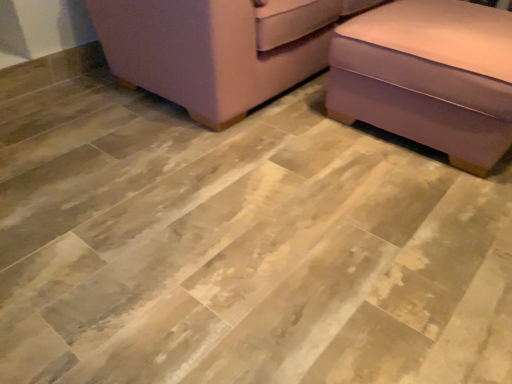
Measure the distance between point (446, 89) and camera.

Point (446, 89) and camera are 5.08 feet apart from each other.

Describe the element at coordinates (428, 77) in the screenshot. I see `purple fabric ottoman at lower right, the first furniture positioned from the right` at that location.

Find the location of a particular element. This screenshot has height=384, width=512. purple fabric ottoman at lower right, the first furniture positioned from the right is located at coordinates (428, 77).

Locate an element on the screen. The height and width of the screenshot is (384, 512). pink fabric couch at upper right, positioned as the first furniture in left-to-right order is located at coordinates (218, 49).

Measure the distance between pink fabric couch at upper right, positioned as the first furniture in left-to-right order, and camera.

The distance of pink fabric couch at upper right, positioned as the first furniture in left-to-right order, from camera is 1.54 meters.

What do you see at coordinates (218, 49) in the screenshot? The height and width of the screenshot is (384, 512). I see `pink fabric couch at upper right, which appears as the second furniture when viewed from the right` at bounding box center [218, 49].

Where is `purple fabric ottoman at lower right, the first furniture positioned from the right`? The height and width of the screenshot is (384, 512). purple fabric ottoman at lower right, the first furniture positioned from the right is located at coordinates point(428,77).

Which is more to the left, purple fabric ottoman at lower right, arranged as the second furniture when viewed from the left, or pink fabric couch at upper right, positioned as the first furniture in left-to-right order?

From the viewer's perspective, pink fabric couch at upper right, positioned as the first furniture in left-to-right order, appears more on the left side.

Is purple fabric ottoman at lower right, the first furniture positioned from the right, closer to camera compared to pink fabric couch at upper right, which appears as the second furniture when viewed from the right?

Yes, purple fabric ottoman at lower right, the first furniture positioned from the right, is in front of pink fabric couch at upper right, which appears as the second furniture when viewed from the right.

Which point is more forward, (393, 19) or (152, 12)?

Positioned in front is point (152, 12).

Based on the photo, from the image's perspective, between purple fabric ottoman at lower right, the first furniture positioned from the right, and pink fabric couch at upper right, positioned as the first furniture in left-to-right order, who is located below?

purple fabric ottoman at lower right, the first furniture positioned from the right, from the image's perspective.

From a real-world perspective, is purple fabric ottoman at lower right, the first furniture positioned from the right, over pink fabric couch at upper right, positioned as the first furniture in left-to-right order?

No, from a real-world perspective, purple fabric ottoman at lower right, the first furniture positioned from the right, is not on top of pink fabric couch at upper right, positioned as the first furniture in left-to-right order.

Is purple fabric ottoman at lower right, the first furniture positioned from the right, wider than pink fabric couch at upper right, which appears as the second furniture when viewed from the right?

In fact, purple fabric ottoman at lower right, the first furniture positioned from the right, might be narrower than pink fabric couch at upper right, which appears as the second furniture when viewed from the right.

Is purple fabric ottoman at lower right, arranged as the second furniture when viewed from the left, taller than pink fabric couch at upper right, which appears as the second furniture when viewed from the right?

No.

Considering the sizes of purple fabric ottoman at lower right, the first furniture positioned from the right, and pink fabric couch at upper right, which appears as the second furniture when viewed from the right, in the image, is purple fabric ottoman at lower right, the first furniture positioned from the right, bigger or smaller than pink fabric couch at upper right, which appears as the second furniture when viewed from the right,?

purple fabric ottoman at lower right, the first furniture positioned from the right, is smaller than pink fabric couch at upper right, which appears as the second furniture when viewed from the right.

Is pink fabric couch at upper right, positioned as the first furniture in left-to-right order, a part of purple fabric ottoman at lower right, arranged as the second furniture when viewed from the left?

No, pink fabric couch at upper right, positioned as the first furniture in left-to-right order, is not a part of purple fabric ottoman at lower right, arranged as the second furniture when viewed from the left.

Are purple fabric ottoman at lower right, the first furniture positioned from the right, and pink fabric couch at upper right, which appears as the second furniture when viewed from the right, far apart?

That's not correct — purple fabric ottoman at lower right, the first furniture positioned from the right, is a little close to pink fabric couch at upper right, which appears as the second furniture when viewed from the right.

Does purple fabric ottoman at lower right, the first furniture positioned from the right, turn towards pink fabric couch at upper right, which appears as the second furniture when viewed from the right?

No, purple fabric ottoman at lower right, the first furniture positioned from the right, is not turned towards pink fabric couch at upper right, which appears as the second furniture when viewed from the right.

Can you tell me how much purple fabric ottoman at lower right, arranged as the second furniture when viewed from the left, and pink fabric couch at upper right, positioned as the first furniture in left-to-right order, differ in facing direction?

The angular difference between purple fabric ottoman at lower right, arranged as the second furniture when viewed from the left, and pink fabric couch at upper right, positioned as the first furniture in left-to-right order, is 0.00159 degrees.

How distant is purple fabric ottoman at lower right, the first furniture positioned from the right, from pink fabric couch at upper right, which appears as the second furniture when viewed from the right?

A distance of 23.59 inches exists between purple fabric ottoman at lower right, the first furniture positioned from the right, and pink fabric couch at upper right, which appears as the second furniture when viewed from the right.

Where is `furniture on the right of pink fabric couch at upper right, which appears as the second furniture when viewed from the right`? Image resolution: width=512 pixels, height=384 pixels. furniture on the right of pink fabric couch at upper right, which appears as the second furniture when viewed from the right is located at coordinates (428, 77).

From the picture: Does pink fabric couch at upper right, positioned as the first furniture in left-to-right order, appear on the right side of purple fabric ottoman at lower right, the first furniture positioned from the right?

No, pink fabric couch at upper right, positioned as the first furniture in left-to-right order, is not to the right of purple fabric ottoman at lower right, the first furniture positioned from the right.

Does pink fabric couch at upper right, which appears as the second furniture when viewed from the right, come behind purple fabric ottoman at lower right, arranged as the second furniture when viewed from the left?

Yes.

Does point (239, 95) come closer to viewer compared to point (404, 68)?

No, it is not.

From the image's perspective, which object appears higher, pink fabric couch at upper right, positioned as the first furniture in left-to-right order, or purple fabric ottoman at lower right, the first furniture positioned from the right?

pink fabric couch at upper right, positioned as the first furniture in left-to-right order, appears higher in the image.

From a real-world perspective, between pink fabric couch at upper right, which appears as the second furniture when viewed from the right, and purple fabric ottoman at lower right, arranged as the second furniture when viewed from the left, who is vertically higher?

pink fabric couch at upper right, which appears as the second furniture when viewed from the right, is physically above.

Considering the sizes of objects pink fabric couch at upper right, positioned as the first furniture in left-to-right order, and purple fabric ottoman at lower right, arranged as the second furniture when viewed from the left, in the image provided, who is thinner, pink fabric couch at upper right, positioned as the first furniture in left-to-right order, or purple fabric ottoman at lower right, arranged as the second furniture when viewed from the left,?

Thinner between the two is purple fabric ottoman at lower right, arranged as the second furniture when viewed from the left.

Considering the sizes of objects pink fabric couch at upper right, which appears as the second furniture when viewed from the right, and purple fabric ottoman at lower right, the first furniture positioned from the right, in the image provided, who is shorter, pink fabric couch at upper right, which appears as the second furniture when viewed from the right, or purple fabric ottoman at lower right, the first furniture positioned from the right,?

purple fabric ottoman at lower right, the first furniture positioned from the right.

Considering the sizes of objects pink fabric couch at upper right, positioned as the first furniture in left-to-right order, and purple fabric ottoman at lower right, arranged as the second furniture when viewed from the left, in the image provided, who is smaller, pink fabric couch at upper right, positioned as the first furniture in left-to-right order, or purple fabric ottoman at lower right, arranged as the second furniture when viewed from the left,?

Smaller between the two is purple fabric ottoman at lower right, arranged as the second furniture when viewed from the left.

Do you think pink fabric couch at upper right, which appears as the second furniture when viewed from the right, is within purple fabric ottoman at lower right, arranged as the second furniture when viewed from the left, or outside of it?

pink fabric couch at upper right, which appears as the second furniture when viewed from the right, is spatially situated outside purple fabric ottoman at lower right, arranged as the second furniture when viewed from the left.

Looking at this image, are pink fabric couch at upper right, positioned as the first furniture in left-to-right order, and purple fabric ottoman at lower right, the first furniture positioned from the right, located far from each other?

No, there isn't a large distance between pink fabric couch at upper right, positioned as the first furniture in left-to-right order, and purple fabric ottoman at lower right, the first furniture positioned from the right.

Could you tell me if pink fabric couch at upper right, positioned as the first furniture in left-to-right order, is turned towards purple fabric ottoman at lower right, arranged as the second furniture when viewed from the left?

Yes.

Can you tell me how much pink fabric couch at upper right, positioned as the first furniture in left-to-right order, and purple fabric ottoman at lower right, arranged as the second furniture when viewed from the left, differ in facing direction?

The angle between the facing direction of pink fabric couch at upper right, positioned as the first furniture in left-to-right order, and the facing direction of purple fabric ottoman at lower right, arranged as the second furniture when viewed from the left, is 0.00159 degrees.

Locate an element on the screen. The height and width of the screenshot is (384, 512). furniture below the pink fabric couch at upper right, positioned as the first furniture in left-to-right order (from the image's perspective) is located at coordinates (428, 77).

The height and width of the screenshot is (384, 512). Identify the location of furniture to the right of pink fabric couch at upper right, which appears as the second furniture when viewed from the right. (428, 77).

You are a GUI agent. You are given a task and a screenshot of the screen. Output one action in this format:
    pyautogui.click(x=<x>, y=<y>)
    Task: Click on the furniture that is below the pink fabric couch at upper right, which appears as the second furniture when viewed from the right (from the image's perspective)
    Image resolution: width=512 pixels, height=384 pixels.
    Given the screenshot: What is the action you would take?
    pyautogui.click(x=428, y=77)